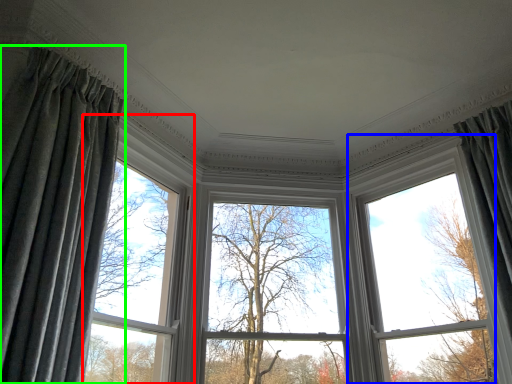
Question: Which object is positioned farthest from window (highlighted by a red box)? Select from bay window (highlighted by a blue box) and curtain (highlighted by a green box).

Choices:
 (A) bay window
 (B) curtain

Answer: (A)